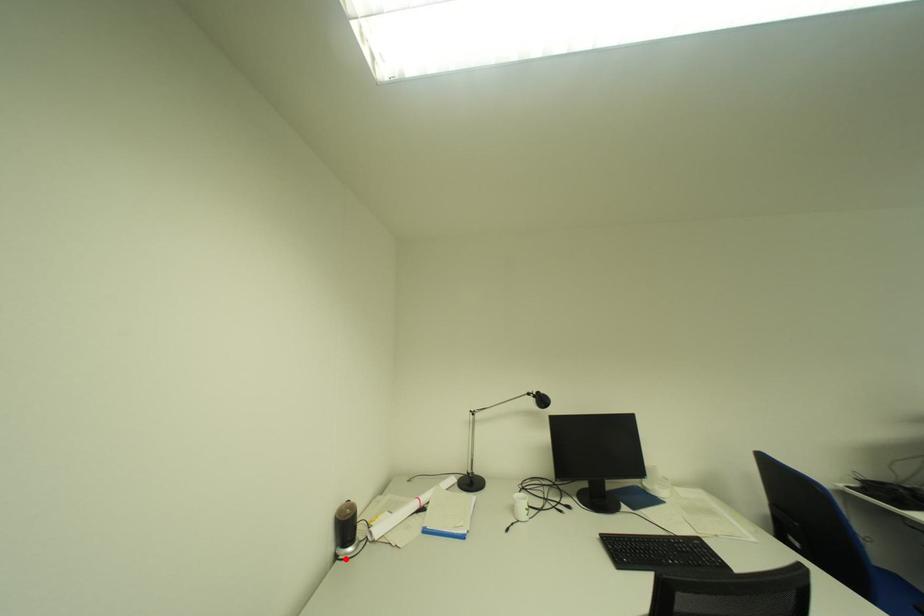
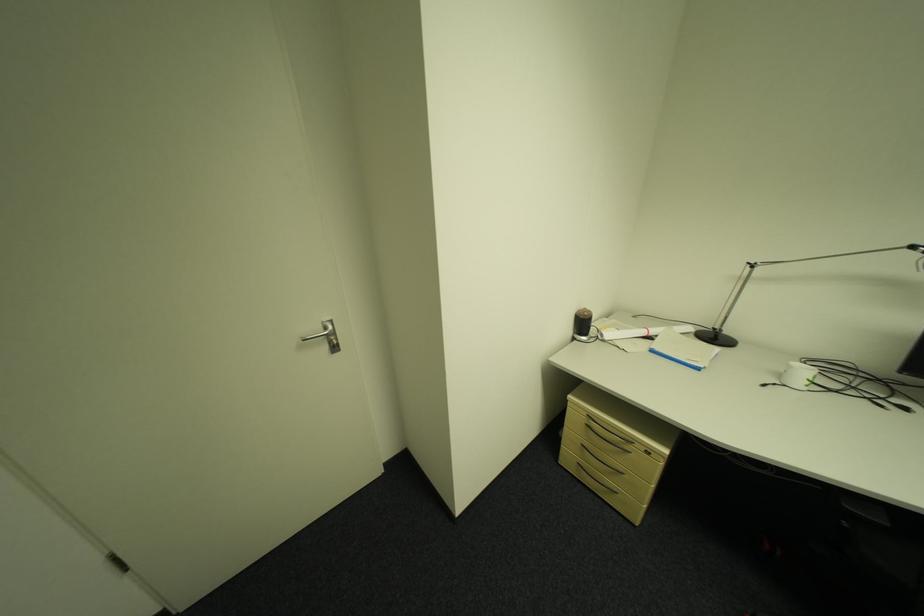
Where in the second image is the point corresponding to the highlighted location from the first image?

(582, 339)